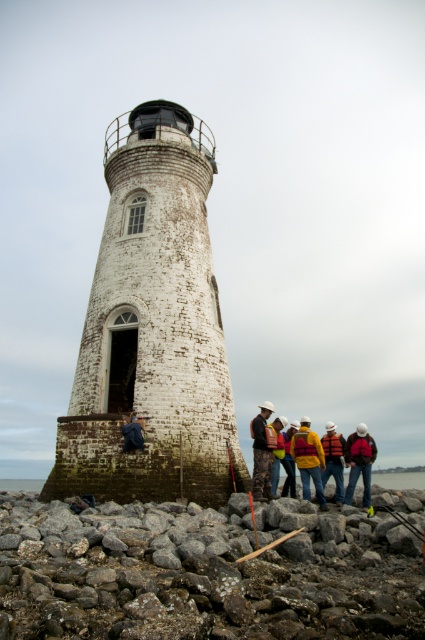
Question: Is gray rough stone at lower left further to camera compared to camouflage jacket at center?

Choices:
 (A) no
 (B) yes

Answer: (A)

Question: Which of these objects is positioned farthest from the red jacket at lower right?

Choices:
 (A) white stone tower at center
 (B) orange life vest at center

Answer: (A)

Question: Which object is the farthest from the camouflage jacket at center?

Choices:
 (A) gray rough stone at lower left
 (B) red jacket at lower right
 (C) white stone tower at center

Answer: (C)

Question: Can you confirm if gray rough stone at lower left is positioned to the right of camouflage jacket at center?

Choices:
 (A) no
 (B) yes

Answer: (A)

Question: Which point is farther to the camera?

Choices:
 (A) click(x=181, y=378)
 (B) click(x=265, y=417)

Answer: (B)

Question: Does white stone tower at center have a smaller size compared to red jacket at lower right?

Choices:
 (A) no
 (B) yes

Answer: (A)